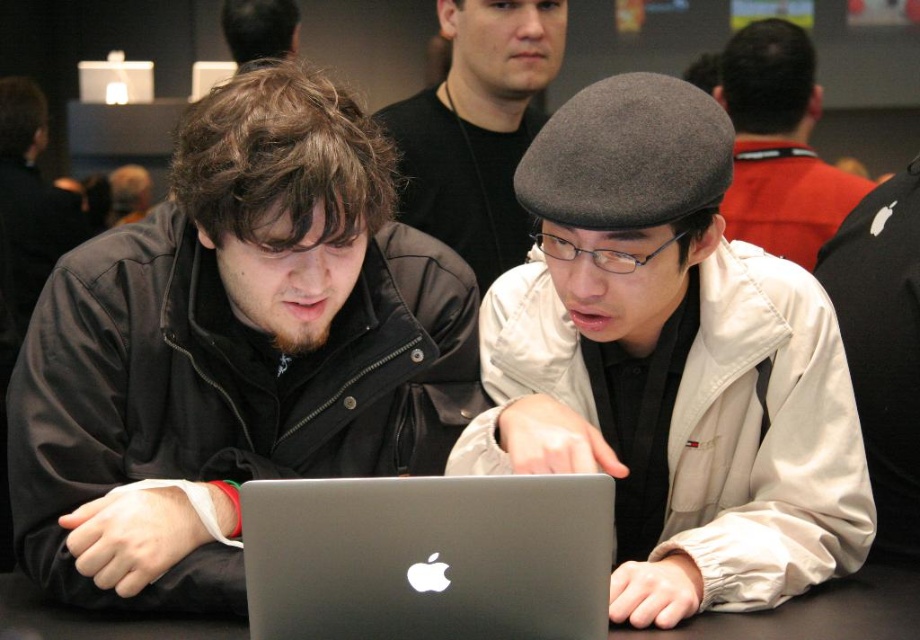
You are standing at the point labeled as point (703, 125) and want to move to the point labeled as point (861, 616). Which direction should you move in to reach your destination?

To move from point (703, 125) to point (861, 616), you should move towards the upper right direction since point (861, 616) is located at a higher x and y coordinate compared to point (703, 125).

You are a photographer standing in front of the scene. You want to take a picture of the matte black jacket at left and the matte black shirt at upper center without any obstructions. Given that the camera you are using has a maximum focus range of 28 inches, will you be able to capture both objects clearly in the same frame?

The matte black jacket at left and matte black shirt at upper center are 29.01 inches apart from each other. Since the camera can only focus up to 28 inches, the distance between them exceeds the focus range. Therefore, you won understand be able to capture both objects clearly in the same frame.

You are a photographer setting up for a group photo. You have a matte gray hat at center and a black matte table at center in your frame. To ensure the hat stays visible, where should you place it relative to the table?

The matte gray hat at center is positioned over the black matte table at center, so placing it directly above the table will keep it visible against the table surface.